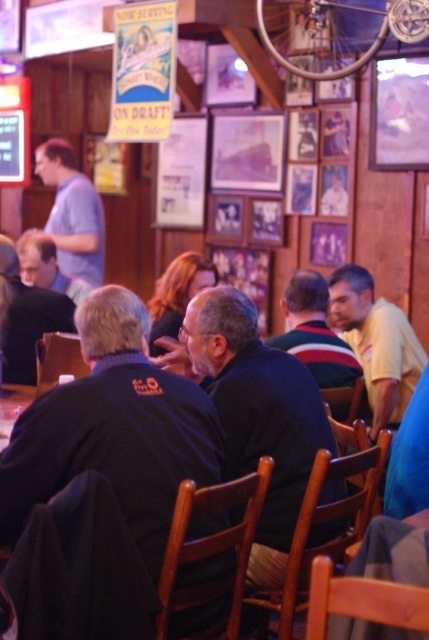
You are a bartender at the Sunset Wharf. You notice two customers wearing a dark blue sweater at center and a light blue shirt at left. Which customer is closer to you?

The dark blue sweater at center is closer to you because it is in front of the light blue shirt at left.

What is located at the coordinates point (114, 429) in the image?

The point (114, 429) is located on the dark blue shirt at center.

You are a photographer at the Sunset Wharf bar. You want to take a photo of the dark blue sweater at center. Where exactly should you focus your camera?

You should focus your camera at point (256, 413) to capture the dark blue sweater at center.